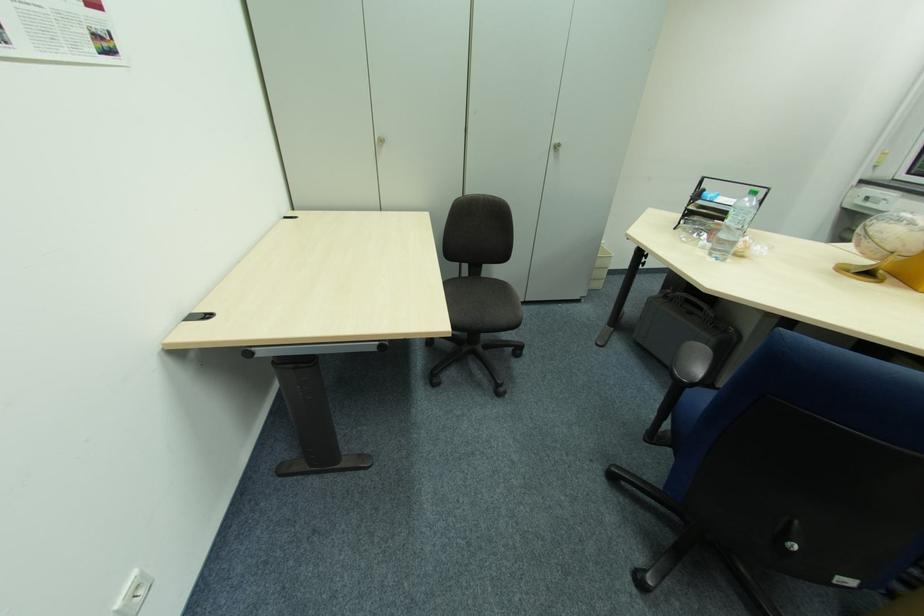
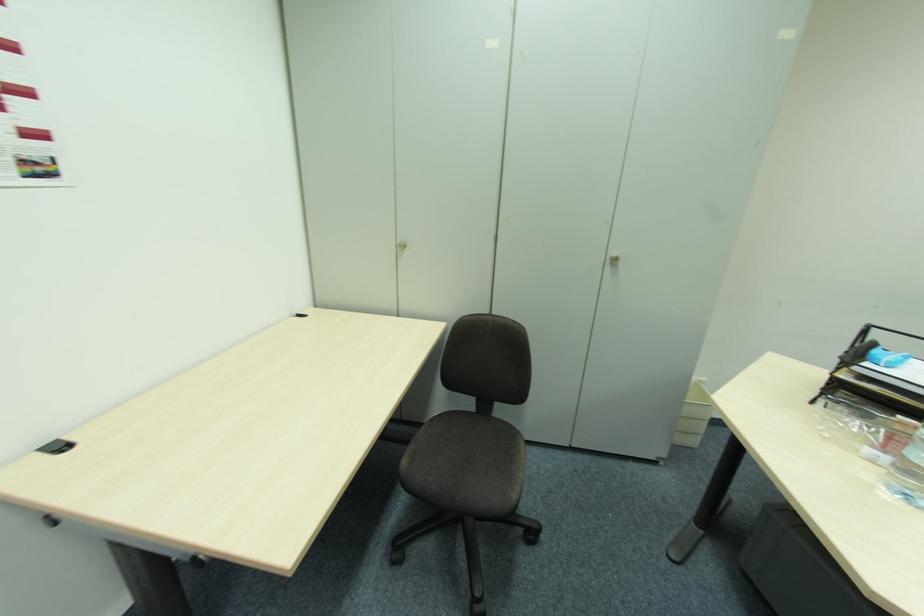
Question: Based on the continuous images, in which direction is the camera rotating? Reply with the corresponding letter.

Choices:
 (A) Left
 (B) Right
 (C) Up
 (D) Down

Answer: (A)